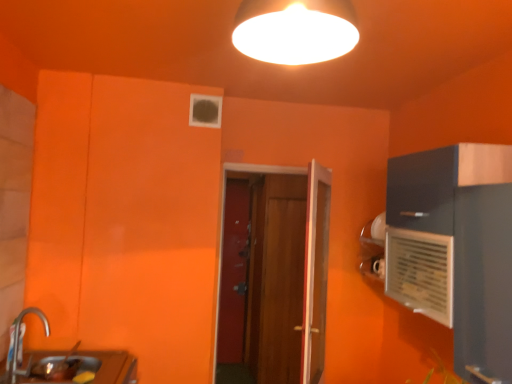
Question: From their relative heights in the image, would you say brushed metal faucet at lower left is taller or shorter than smooth wooden door at center, which is the 3th door from front to back?

Choices:
 (A) short
 (B) tall

Answer: (A)

Question: Looking at their shapes, would you say brushed metal faucet at lower left is wider or thinner than smooth wooden door at center, which is the 3th door from front to back?

Choices:
 (A) wide
 (B) thin

Answer: (A)

Question: Based on their relative distances, which object is farther from the brushed metal faucet at lower left?

Choices:
 (A) wooden door at center, arranged as the 2th door when viewed from the front
 (B) wooden door at center, placed as the 3th door when sorted from back to front
 (C) metallic silver sink at lower left
 (D) smooth wooden door at center, which is the 3th door from front to back
 (E) white plastic air conditioner at right

Answer: (D)

Question: Estimate the real-world distances between objects in this image. Which object is farther from the metallic silver sink at lower left?

Choices:
 (A) white plastic air conditioner at right
 (B) smooth wooden door at center, placed as the 1th door when sorted from back to front
 (C) white glossy lampshade at upper center
 (D) brushed metal faucet at lower left
 (E) wooden door at center, acting as the second door starting from the back

Answer: (B)